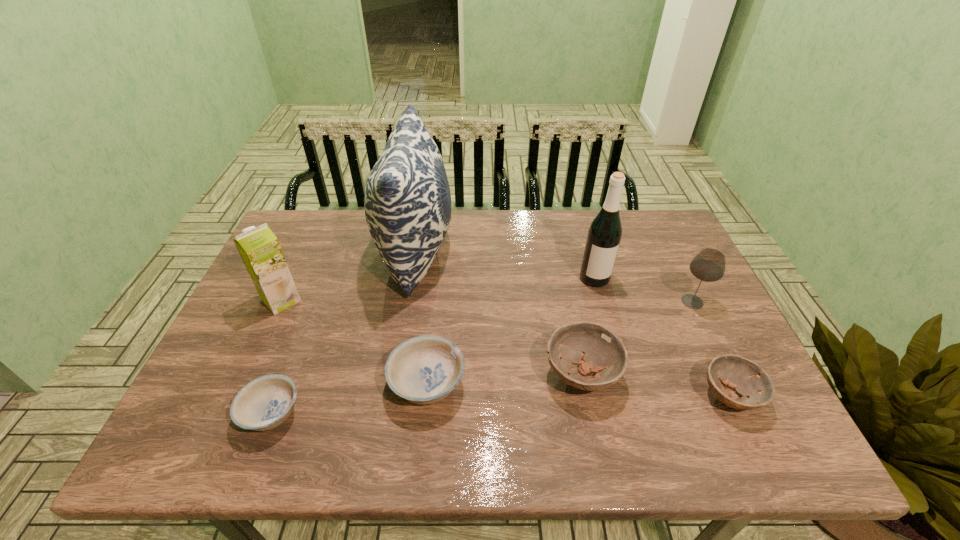
This screenshot has width=960, height=540. In the image, there is a desktop. What are the coordinates of `blank space at the near edge` in the screenshot? It's located at (497, 420).

Image resolution: width=960 pixels, height=540 pixels. I want to click on free space at the left edge of the desktop, so click(225, 382).

Where is `vacant space at the right edge of the desktop`? Image resolution: width=960 pixels, height=540 pixels. vacant space at the right edge of the desktop is located at coordinates (692, 370).

Where is `free point at the far left corner`? The width and height of the screenshot is (960, 540). free point at the far left corner is located at coordinates pyautogui.click(x=323, y=212).

Identify the location of vacant space in between the shortest bowl and the green soya milk. The image size is (960, 540). (276, 357).

Identify the location of vacant space that's between the blue cushion and the gray wineglass. This screenshot has height=540, width=960. (554, 276).

Identify the location of vacant point located between the smaller brown bowl and the green soya milk. The width and height of the screenshot is (960, 540). [506, 348].

Image resolution: width=960 pixels, height=540 pixels. Find the location of `vacant space that is in between the right brown bowl and the dark wine bottle`. vacant space that is in between the right brown bowl and the dark wine bottle is located at coordinates (662, 336).

At what (x,y) coordinates should I click in order to perform the action: click on vacant space in between the bigger brown bowl and the rightmost bowl. Please return your answer as a coordinate pair (x, y). Looking at the image, I should click on (656, 384).

Identify the location of free spot between the rightmost bowl and the dark wine bottle. The image size is (960, 540). (662, 336).